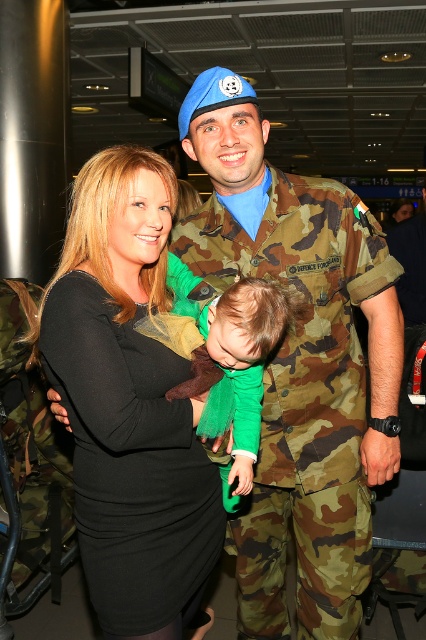
You are an airport security officer and need to check the items of both the camouflage uniform at center and the black matte dress at center. Which one is closer to your right side?

The camouflage uniform at center is positioned on the right side of black matte dress at center, so the camouflage uniform at center is closer to your right side.

You are an airport security agent checking the height requirements for a restricted area. The minimum height requirement is 1.6 meters. You observe a man in camouflage uniform at center and a woman in black matte dress at center. Which individual meets the height requirement?

The camouflage uniform at center is much taller than the black matte dress at center, so the man in camouflage uniform at center likely meets the height requirement of 1.6 meters.

You are an airport security officer checking the layout of the terminal. You notice a camouflage uniform at center and a black matte dress at center. Which one is positioned higher in the image?

The camouflage uniform at center is positioned higher than the black matte dress at center in the image.